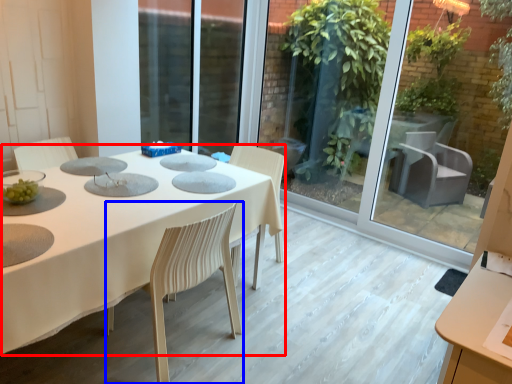
Question: Which object appears closest to the camera in this image, table (highlighted by a red box) or chair (highlighted by a blue box)?

Choices:
 (A) table
 (B) chair

Answer: (A)